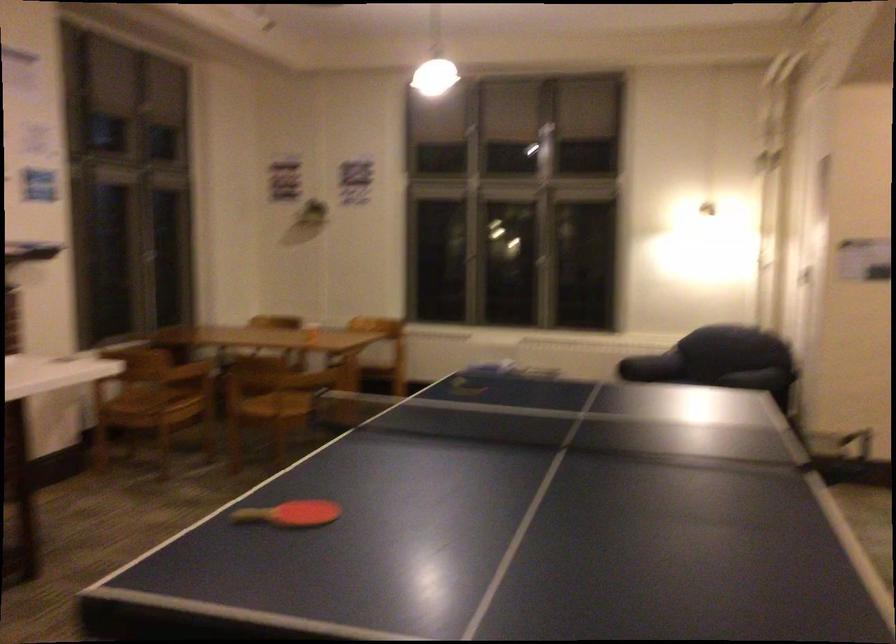
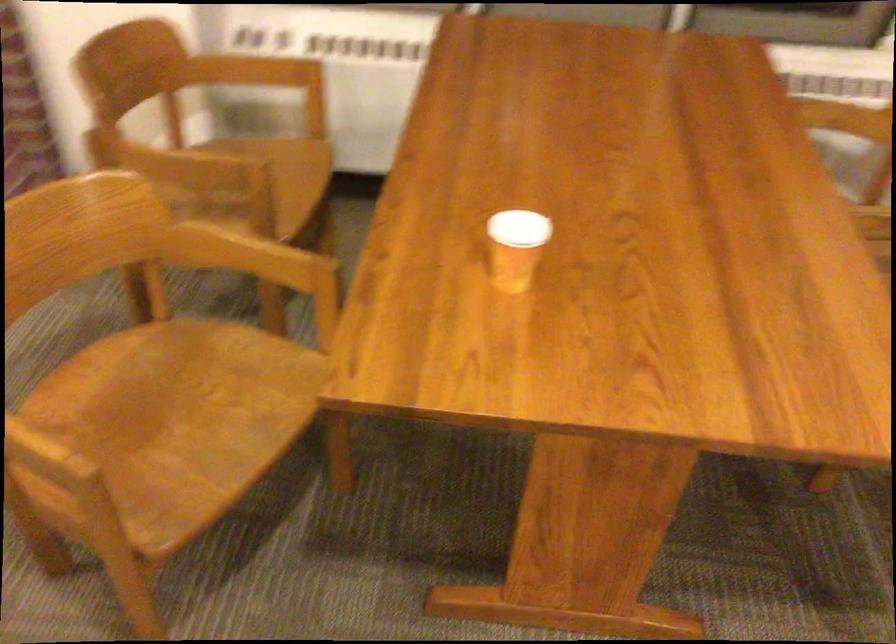
Find the pixel in the second image that matches (x=205, y=372) in the first image.

(252, 182)